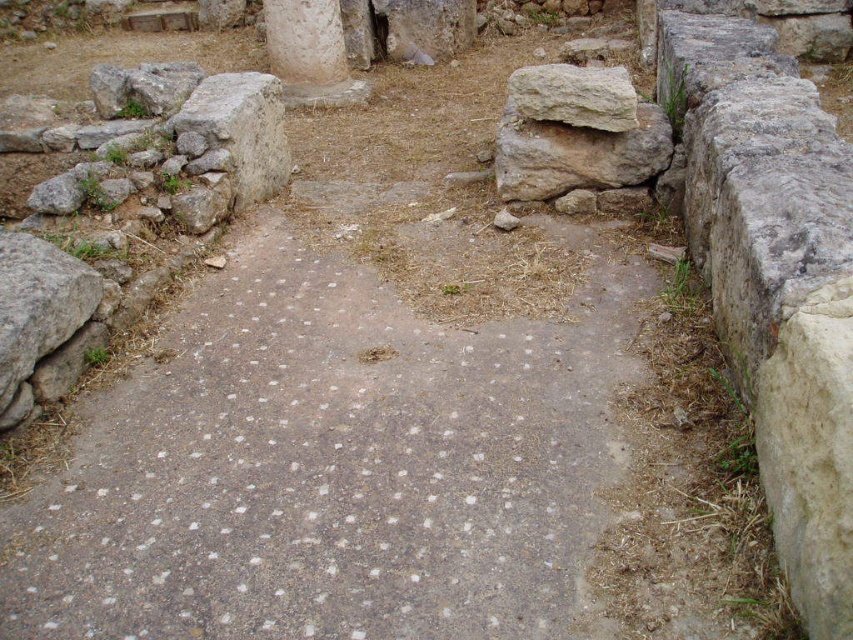
Does gray stone path at center have a lesser height compared to light gray stone boulder at upper right?

In fact, gray stone path at center may be taller than light gray stone boulder at upper right.

Between gray stone path at center and light gray stone boulder at upper right, which one appears on the right side from the viewer's perspective?

From the viewer's perspective, light gray stone boulder at upper right appears more on the right side.

This screenshot has width=853, height=640. Identify the location of gray stone path at center. (335, 460).